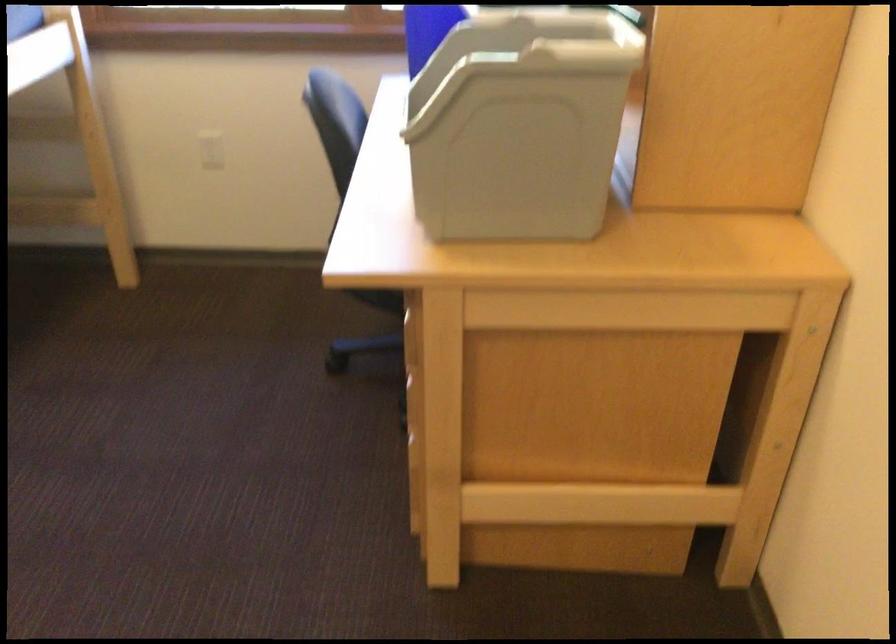
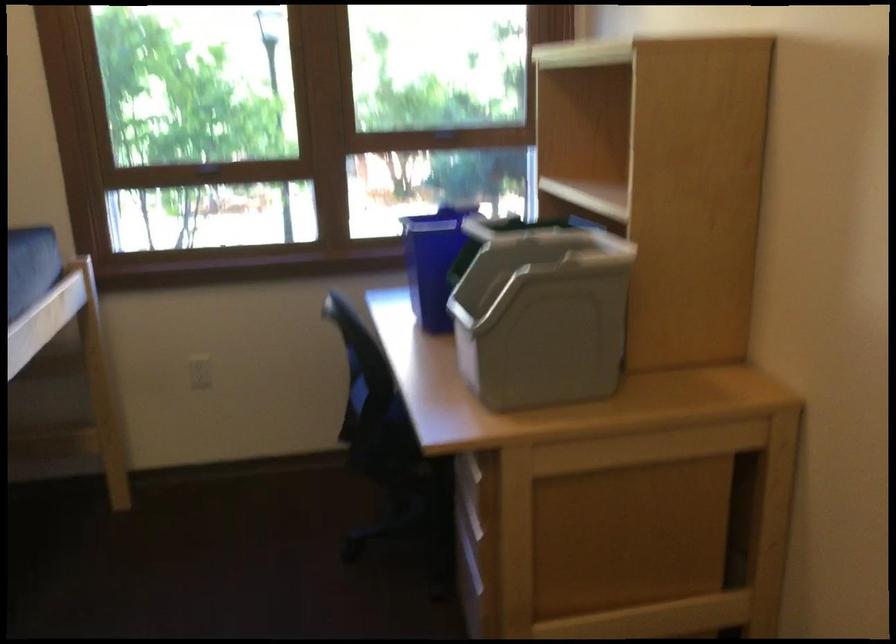
Which direction would the cameraman need to move to produce the second image?

The cameraman moved toward left, backward.